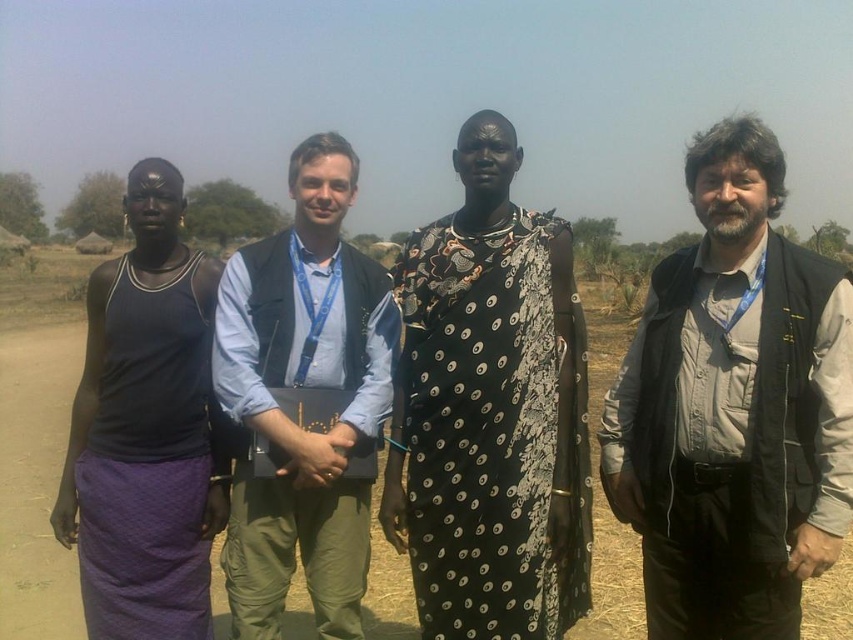
Consider the image. You are a photographer trying to capture a clear photo of the gray fabric vest at center and the black printed dress at center. Since you want both subjects to be in focus, which one should you focus on first?

The gray fabric vest at center is in front of the black printed dress at center, so you should focus on the gray fabric vest at center first to ensure both are in focus.

Please describe the spatial relationship between the black printed dress at center and the point located at coordinates (490, 410).

The point at coordinates (490, 410) is located on the black printed dress at center.